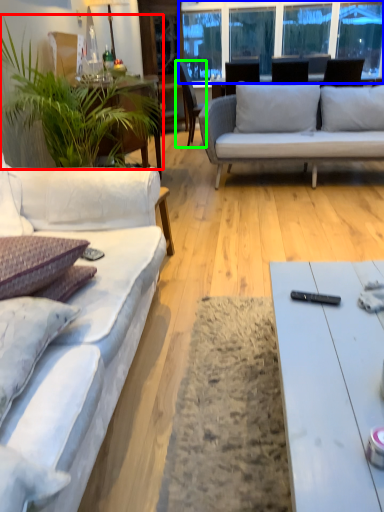
Question: Which object is the farthest from houseplant (highlighted by a red box)? Choose among these: window screen (highlighted by a blue box) or chair (highlighted by a green box).

Choices:
 (A) window screen
 (B) chair

Answer: (A)